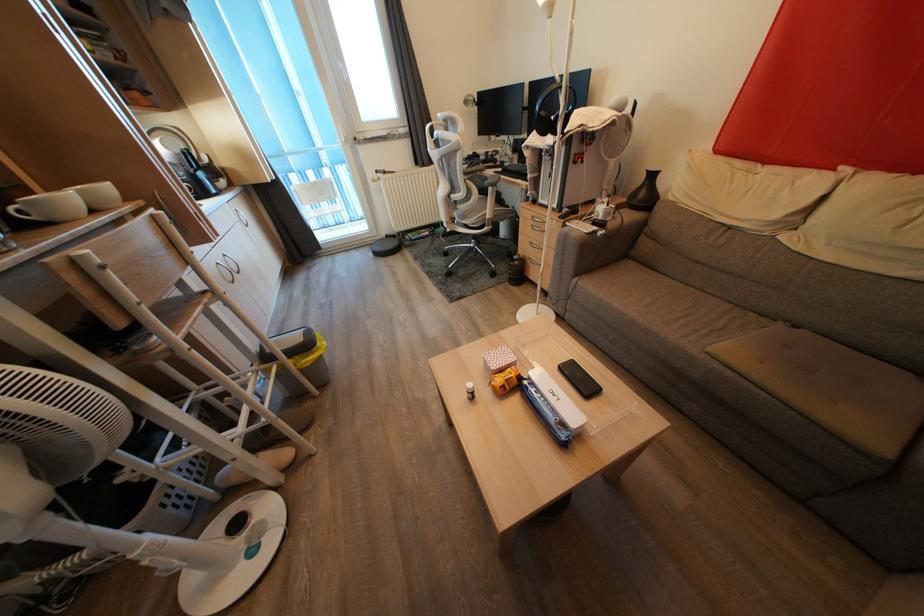
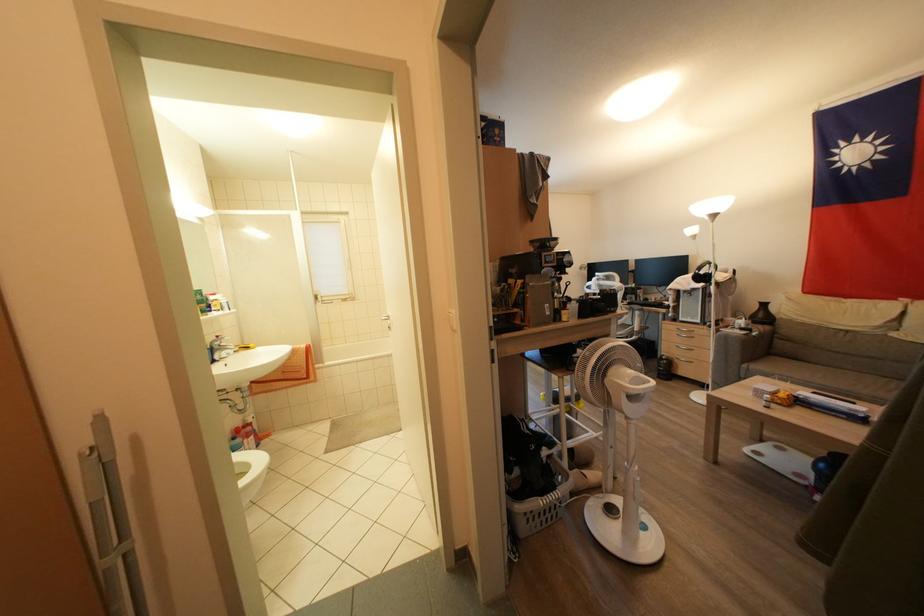
Find the pixel in the second image that matches (x=647, y=199) in the first image.

(766, 320)